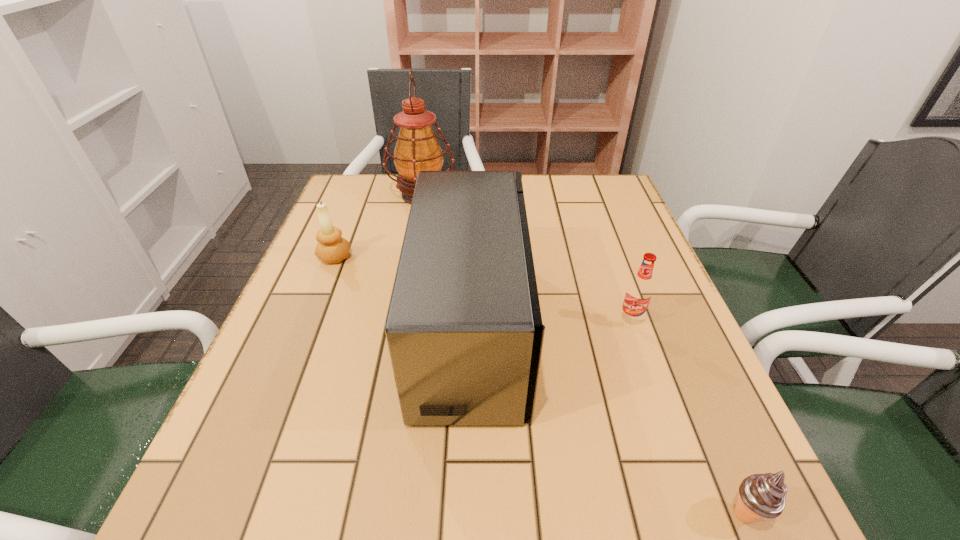
Identify the location of vacant space at the far edge. The height and width of the screenshot is (540, 960). (553, 186).

In the image, there is a desktop. At what (x,y) coordinates should I click in order to perform the action: click on vacant space at the near edge. Please return your answer as a coordinate pair (x, y). Image resolution: width=960 pixels, height=540 pixels. Looking at the image, I should click on (491, 511).

At what (x,y) coordinates should I click in order to perform the action: click on vacant space at the left edge. Please return your answer as a coordinate pair (x, y). This screenshot has height=540, width=960. Looking at the image, I should click on (322, 286).

Where is `vacant space at the right edge`? Image resolution: width=960 pixels, height=540 pixels. vacant space at the right edge is located at coordinates pyautogui.click(x=603, y=263).

In order to click on free space at the far left corner of the desktop in this screenshot , I will do `click(383, 207)`.

In the image, there is a desktop. At what (x,y) coordinates should I click in order to perform the action: click on free region at the far right corner. Please return your answer as a coordinate pair (x, y). This screenshot has height=540, width=960. Looking at the image, I should click on (617, 180).

I want to click on blank region between the nearest object and the tallest object, so click(584, 355).

Where is `free space between the second tallest object and the nearest object`? free space between the second tallest object and the nearest object is located at coordinates (609, 422).

Identify the location of vacant space in between the rightmost object and the candle_holder. (540, 386).

Locate an element on the screen. free spot between the tallest object and the nearest object is located at coordinates (584, 355).